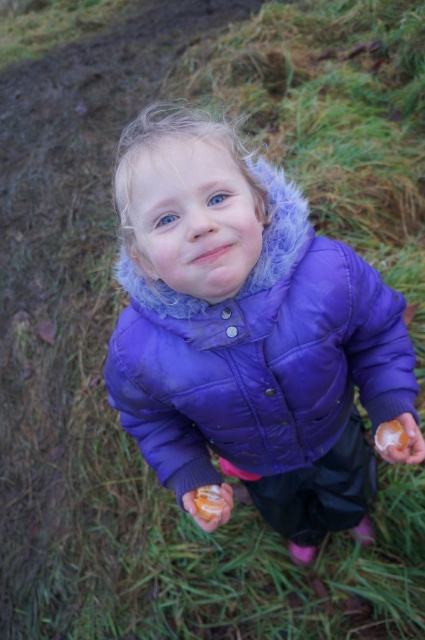
Is matte orange donut at center to the left of orange matte donut at center from the viewer's perspective?

Yes, matte orange donut at center is to the left of orange matte donut at center.

Does point (212, 502) come behind point (393, 422)?

No.

Find the location of a particular element. Image resolution: width=425 pixels, height=640 pixels. matte orange donut at center is located at coordinates (209, 500).

Is purple puffy jacket at center to the left of matte orange donut at center from the viewer's perspective?

No, purple puffy jacket at center is not to the left of matte orange donut at center.

Locate an element on the screen. purple puffy jacket at center is located at coordinates (249, 333).

Locate an element on the screen. The image size is (425, 640). purple puffy jacket at center is located at coordinates 249,333.

This screenshot has height=640, width=425. What are the coordinates of `purple puffy jacket at center` in the screenshot? It's located at (249, 333).

Does point (190, 259) lie in front of point (382, 440)?

Yes, point (190, 259) is closer to viewer.

In order to click on purple puffy jacket at center in this screenshot , I will do `click(249, 333)`.